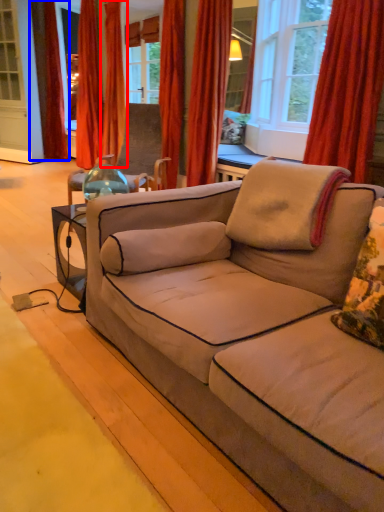
Question: Which object is closer to the camera taking this photo, curtain (highlighted by a red box) or curtain (highlighted by a blue box)?

Choices:
 (A) curtain
 (B) curtain

Answer: (A)